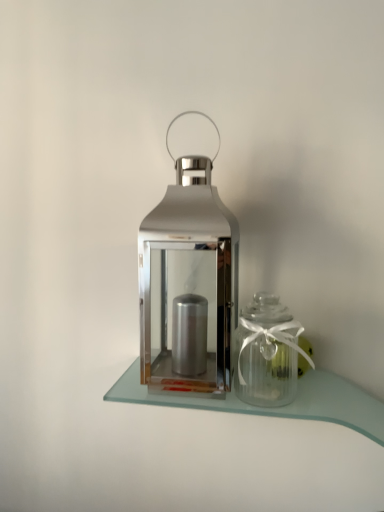
Question: Is shiny metallic lantern at center taller or shorter than clear glass table at center?

Choices:
 (A) tall
 (B) short

Answer: (A)

Question: Is shiny metallic lantern at center situated inside clear glass table at center or outside?

Choices:
 (A) inside
 (B) outside

Answer: (B)

Question: Estimate the real-world distances between objects in this image. Which object is farther from the clear glass jar at right?

Choices:
 (A) shiny metallic lantern at center
 (B) clear glass table at center

Answer: (A)

Question: Which object is positioned closest to the clear glass table at center?

Choices:
 (A) shiny metallic lantern at center
 (B) clear glass jar at right

Answer: (B)